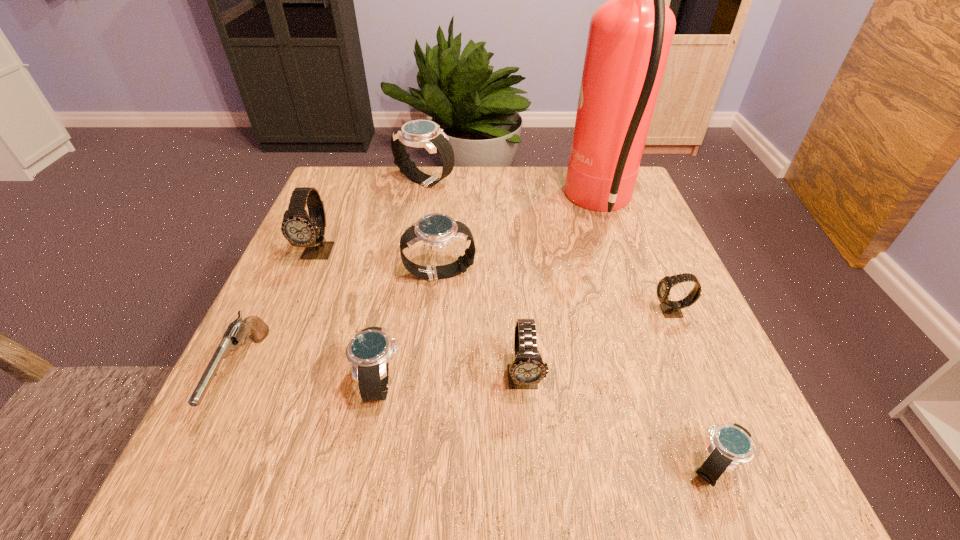
Where is `free spot between the nearest watch and the second nearest gray watch`? The image size is (960, 540). free spot between the nearest watch and the second nearest gray watch is located at coordinates (693, 389).

This screenshot has height=540, width=960. In order to click on vacant space that is in between the leftmost watch and the second farthest silver watch in this screenshot , I will do `click(379, 263)`.

Locate an element on the screen. The image size is (960, 540). vacant space that's between the fourth farthest watch and the tallest object is located at coordinates (636, 258).

This screenshot has height=540, width=960. I want to click on vacant area that lies between the smallest gray watch and the nearest gray watch, so pos(597,345).

This screenshot has width=960, height=540. Identify the location of unoccupied area between the gun and the shortest watch. (479, 421).

The height and width of the screenshot is (540, 960). Identify the location of free space between the smallest gray watch and the red fire extinguisher. (636, 258).

Locate an element on the screen. This screenshot has height=540, width=960. unoccupied position between the nearest watch and the third nearest silver watch is located at coordinates (577, 370).

At what (x,y) coordinates should I click in order to perform the action: click on free spot between the second smallest gray watch and the tallest object. Please return your answer as a coordinate pair (x, y). This screenshot has height=540, width=960. Looking at the image, I should click on (563, 291).

Find the location of a particular element. empty space between the leftmost watch and the fifth watch from left to right is located at coordinates (421, 314).

The width and height of the screenshot is (960, 540). Identify the location of vacant area that lies between the smallest gray watch and the gun. (457, 343).